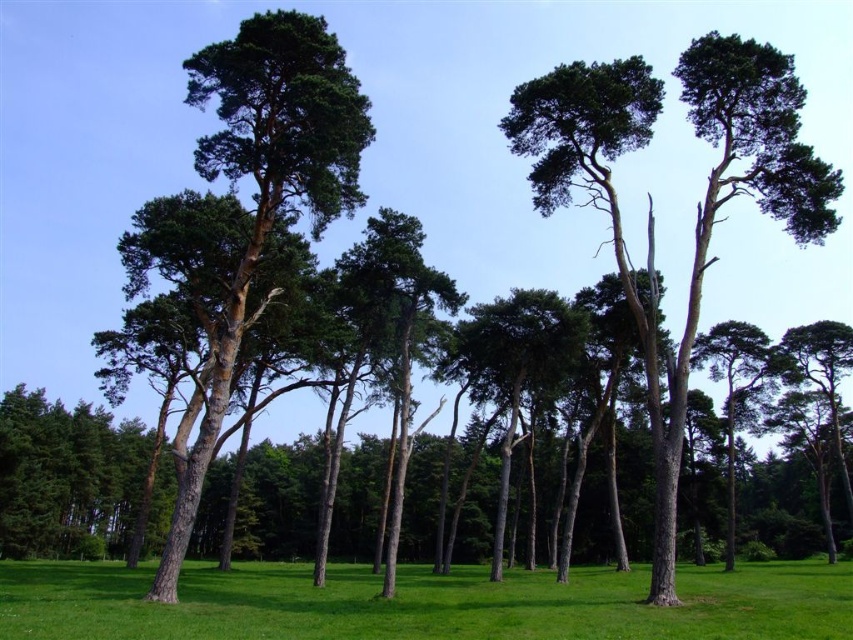
You are a hiker standing at the edge of the forest. You see the green grass at center and the green matte tree at center. Which object is closer to you?

The green grass at center is closer to you because it is in front of the green matte tree at center.

You are a gardener planning to plant a new flower bed between the green grass at center and the green matte tree at center. Based on the space available, which area would you choose for the flower bed?

The green grass at center might be wider than the green matte tree at center, so the gardener should choose the area near the green grass at center for the flower bed since it offers more space.

You are a gardener standing in the forest scene. You notice the green grass at center and the green matte tree at center. Which object is positioned lower in the image?

The green grass at center is located below the green matte tree at center, so it is positioned lower in the image.